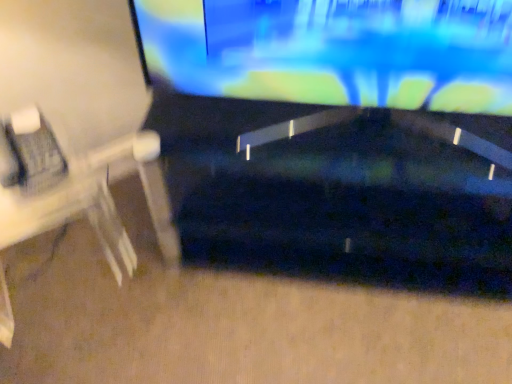
Find the location of a particular element. vacant space to the right of white plastic computer desk at left is located at coordinates (165, 310).